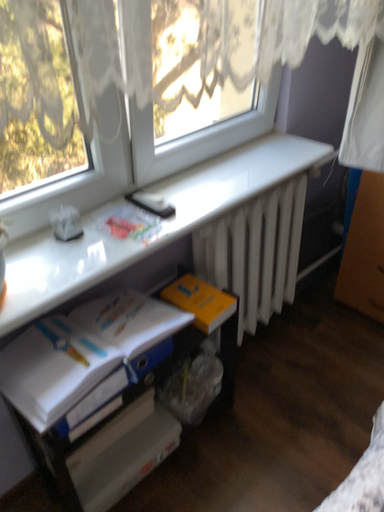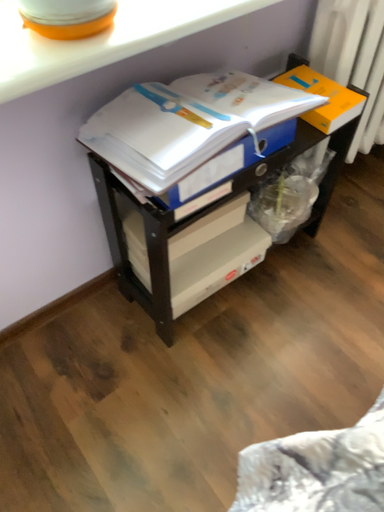
Question: Which way did the camera rotate in the video?

Choices:
 (A) rotated upward
 (B) rotated downward

Answer: (B)